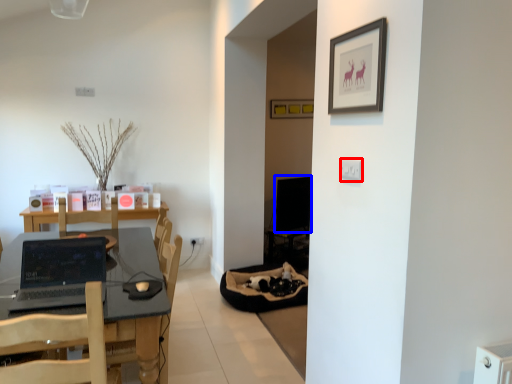
Question: Among these objects, which one is nearest to the camera, electric outlet (highlighted by a red box) or computer monitor (highlighted by a blue box)?

Choices:
 (A) electric outlet
 (B) computer monitor

Answer: (A)